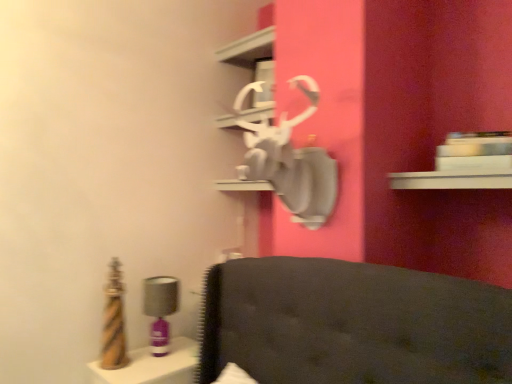
Question: In terms of size, does white glossy shelf at upper center appear bigger or smaller than matte purple table lamp at left?

Choices:
 (A) small
 (B) big

Answer: (B)

Question: Is white glossy shelf at upper center inside the boundaries of matte purple table lamp at left, or outside?

Choices:
 (A) outside
 (B) inside

Answer: (A)

Question: Estimate the real-world distances between objects in this image. Which object is farther from the metallic gold vanity at lower left?

Choices:
 (A) matte purple table lamp at left
 (B) white glossy shelf at upper center

Answer: (B)

Question: Considering the real-world distances, which object is closest to the matte purple table lamp at left?

Choices:
 (A) metallic gold vanity at lower left
 (B) white glossy shelf at upper center

Answer: (A)